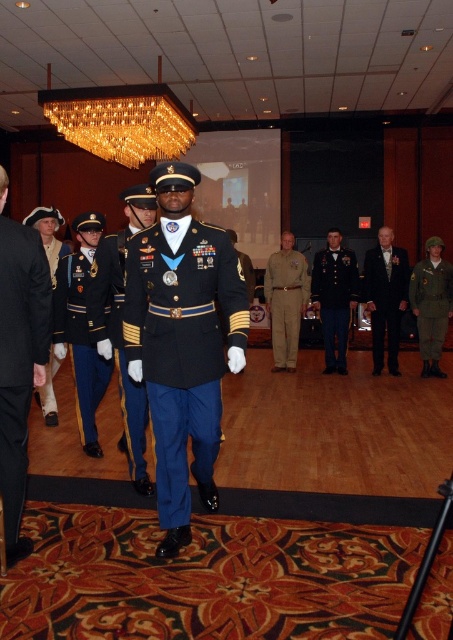
Question: Where is dark blue wool military uniform at left located in relation to shiny blue fabric uniform at center in the image?

Choices:
 (A) right
 (B) left

Answer: (B)

Question: Can you confirm if shiny black fabric uniform at center is smaller than shiny dark blue uniform at center?

Choices:
 (A) yes
 (B) no

Answer: (A)

Question: Which point is farther to the camera?

Choices:
 (A) (442, 348)
 (B) (94, 422)
 (C) (49, 369)

Answer: (A)

Question: Is shiny blue fabric uniform at center thinner than shiny dark blue uniform at center?

Choices:
 (A) yes
 (B) no

Answer: (A)

Question: Which object is farther from the camera taking this photo?

Choices:
 (A) shiny dark blue uniform at center
 (B) black satin suit at center

Answer: (A)

Question: Estimate the real-world distances between objects in this image. Which object is farther from the black satin suit at center?

Choices:
 (A) shiny gold epaulets at left
 (B) shiny blue uniform at center
 (C) shiny blue fabric uniform at center

Answer: (B)